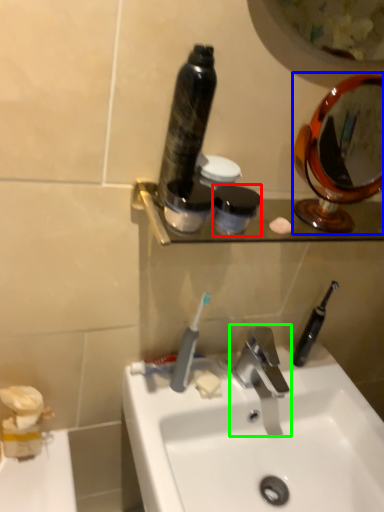
Question: Which object is positioned farthest from mouthwash (highlighted by a red box)? Select from mirror (highlighted by a blue box) and tap (highlighted by a green box).

Choices:
 (A) mirror
 (B) tap

Answer: (A)